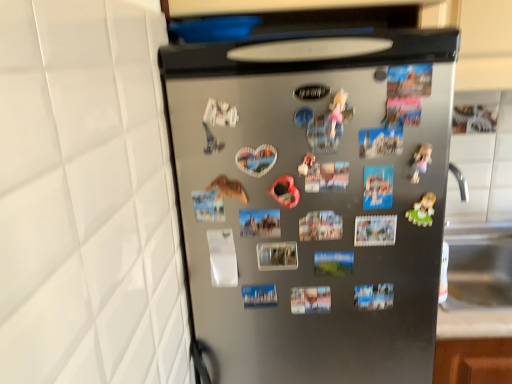
Question: Is satin silver refrigerator at center wider or thinner than plastic green toy at right?

Choices:
 (A) wide
 (B) thin

Answer: (A)

Question: Is satin silver refrigerator at center spatially inside plastic green toy at right, or outside of it?

Choices:
 (A) outside
 (B) inside

Answer: (A)

Question: Is satin silver refrigerator at center taller or shorter than plastic green toy at right?

Choices:
 (A) tall
 (B) short

Answer: (A)

Question: Considering their positions, is plastic green toy at right located in front of or behind satin silver refrigerator at center?

Choices:
 (A) front
 (B) behind

Answer: (B)

Question: Choose the correct answer: Is plastic green toy at right inside satin silver refrigerator at center or outside it?

Choices:
 (A) outside
 (B) inside

Answer: (B)

Question: Considering the positions of plastic green toy at right and satin silver refrigerator at center in the image, is plastic green toy at right wider or thinner than satin silver refrigerator at center?

Choices:
 (A) thin
 (B) wide

Answer: (A)

Question: In terms of height, does plastic green toy at right look taller or shorter compared to satin silver refrigerator at center?

Choices:
 (A) short
 (B) tall

Answer: (A)